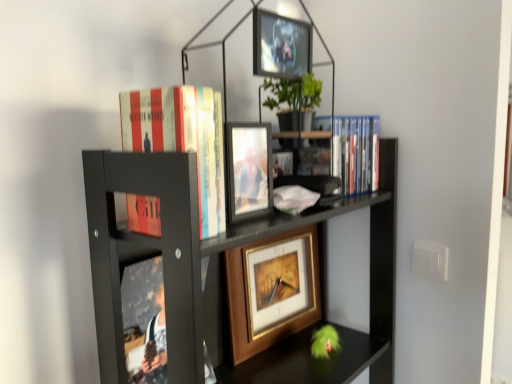
Question: From the image's perspective, is gold-framed picture at center, the 3th picture frame in the front-to-back sequence, below black matte bookcase at upper center?

Choices:
 (A) no
 (B) yes

Answer: (A)

Question: Is gold-framed picture at center, which is counted as the 1th picture frame, starting from the bottom, with black matte bookcase at upper center?

Choices:
 (A) yes
 (B) no

Answer: (B)

Question: Is gold-framed picture at center, which is counted as the 1th picture frame, starting from the bottom, facing away from black matte bookcase at upper center?

Choices:
 (A) yes
 (B) no

Answer: (A)

Question: Is the position of gold-framed picture at center, the 3th picture frame in the front-to-back sequence, less distant than that of black matte bookcase at upper center?

Choices:
 (A) no
 (B) yes

Answer: (A)

Question: From a real-world perspective, is gold-framed picture at center, marked as the 1th picture frame in a back-to-front arrangement, positioned under black matte bookcase at upper center based on gravity?

Choices:
 (A) yes
 (B) no

Answer: (A)

Question: Would you say matte glass photo frame at center, the second picture frame when ordered from top to bottom, is outside hardcover book at upper center, the second book positioned from the back?

Choices:
 (A) yes
 (B) no

Answer: (A)

Question: Is matte glass photo frame at center, the second picture frame when ordered from bottom to top, taller than hardcover book at upper center, which is the 1th book in front-to-back order?

Choices:
 (A) yes
 (B) no

Answer: (B)

Question: Does matte glass photo frame at center, positioned as the 3th picture frame in back-to-front order, have a greater width compared to hardcover book at upper center, the 2th book viewed from the right?

Choices:
 (A) yes
 (B) no

Answer: (B)

Question: Does matte glass photo frame at center, positioned as the 3th picture frame in back-to-front order, lie behind hardcover book at upper center, which ranks as the 1th book in left-to-right order?

Choices:
 (A) no
 (B) yes

Answer: (B)

Question: From the image's perspective, is matte glass photo frame at center, which is the 1th picture frame in front-to-back order, below hardcover book at upper center, which is the 1th book in front-to-back order?

Choices:
 (A) yes
 (B) no

Answer: (A)

Question: Can you confirm if matte glass photo frame at center, positioned as the 3th picture frame in back-to-front order, is positioned to the right of hardcover book at upper center, the 2th book viewed from the right?

Choices:
 (A) no
 (B) yes

Answer: (B)

Question: From the image's perspective, does black matte bookcase at upper center appear lower than matte glass photo frame at center, the second picture frame when ordered from bottom to top?

Choices:
 (A) yes
 (B) no

Answer: (A)